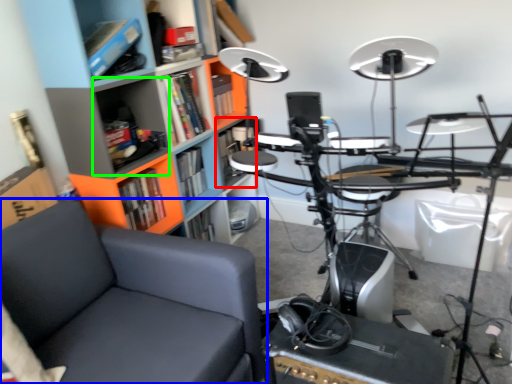
Question: Which object is the closest to the shelf (highlighted by a red box)? Choose among these: chair (highlighted by a blue box) or shelf (highlighted by a green box).

Choices:
 (A) chair
 (B) shelf

Answer: (B)